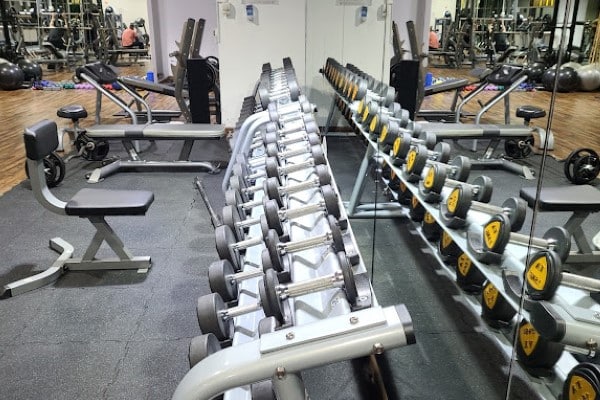
Find the location of a particular element. Image resolution: width=600 pixels, height=400 pixels. exercise area is located at coordinates (103, 234), (179, 128), (100, 80), (143, 81).